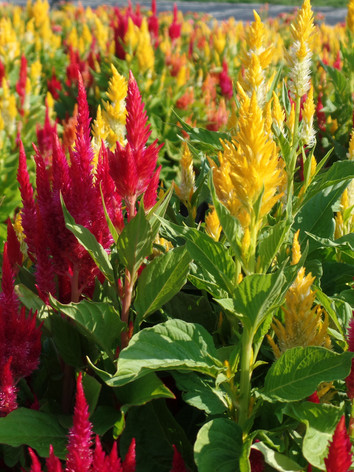
Locate an element on the screen. This screenshot has height=472, width=354. plants in focus is located at coordinates (81, 431), (15, 315), (84, 188), (258, 177), (115, 104), (276, 117).